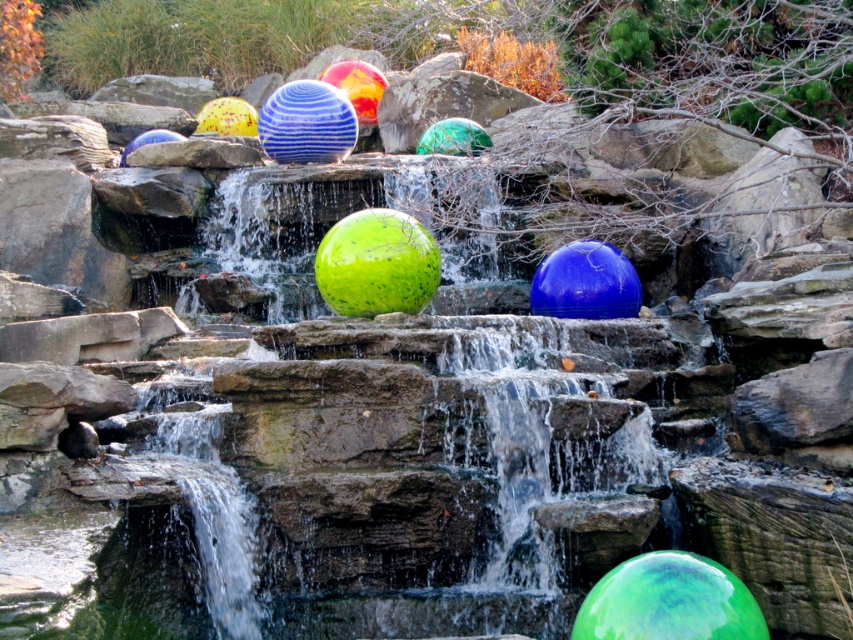
Does yellow matte beach ball at upper left have a greater width compared to matte blue ball at upper left?

Yes, yellow matte beach ball at upper left is wider than matte blue ball at upper left.

Looking at this image, can you confirm if yellow matte beach ball at upper left is positioned to the right of matte blue ball at upper left?

Yes, yellow matte beach ball at upper left is to the right of matte blue ball at upper left.

Does point (199, 124) come farther from viewer compared to point (125, 157)?

Yes, point (199, 124) is farther from viewer.

This screenshot has height=640, width=853. Find the location of `yellow matte beach ball at upper left`. yellow matte beach ball at upper left is located at coordinates (227, 116).

Who is lower down, green glossy sphere at center or blue striped sphere at center?

Positioned lower is green glossy sphere at center.

The width and height of the screenshot is (853, 640). I want to click on green glossy sphere at center, so click(668, 602).

Image resolution: width=853 pixels, height=640 pixels. I want to click on green glossy sphere at center, so click(668, 602).

Is glossy blue sphere at center taller than yellow matte beach ball at upper left?

Incorrect, glossy blue sphere at center's height is not larger of yellow matte beach ball at upper left's.

Can you confirm if glossy blue sphere at center is positioned to the right of yellow matte beach ball at upper left?

Indeed, glossy blue sphere at center is positioned on the right side of yellow matte beach ball at upper left.

Is point (598, 268) positioned in front of point (231, 125)?

Yes, it is in front of point (231, 125).

Find the location of a particular element. This screenshot has height=640, width=853. glossy blue sphere at center is located at coordinates [x=585, y=282].